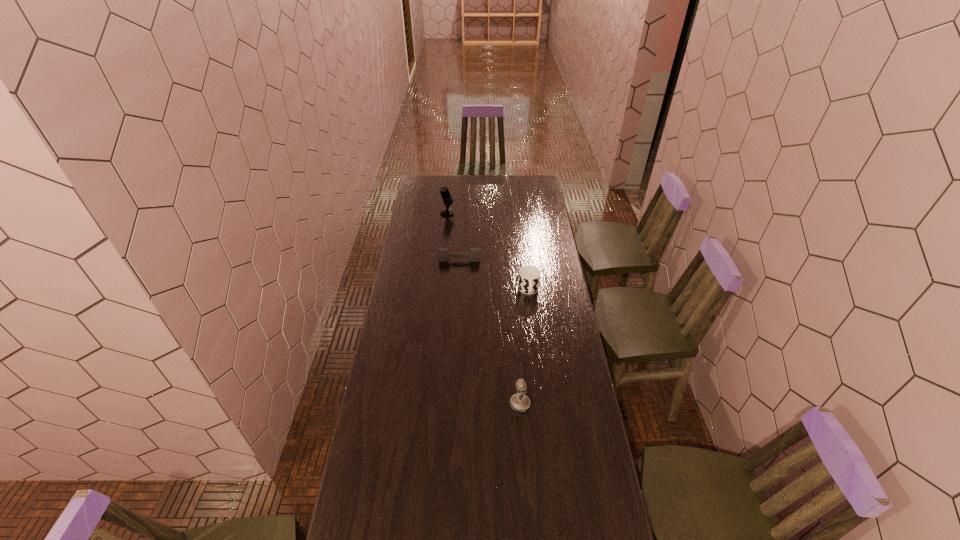
Where is `object that ranks as the closest to the right microphone`? This screenshot has width=960, height=540. object that ranks as the closest to the right microphone is located at coordinates (529, 276).

Image resolution: width=960 pixels, height=540 pixels. In order to click on object that ranks as the closest to the shortest object in this screenshot , I will do (529, 276).

Identify the location of vacant region that satisfies the following two spatial constraints: 1. on the stand of the farther microphone; 2. on the left side of the second farthest object. The height and width of the screenshot is (540, 960). (443, 260).

This screenshot has height=540, width=960. Find the location of `vacant area that satisfies the following two spatial constraints: 1. on the stand of the farther microphone; 2. on the left side of the dumbbell`. vacant area that satisfies the following two spatial constraints: 1. on the stand of the farther microphone; 2. on the left side of the dumbbell is located at coordinates (443, 260).

Image resolution: width=960 pixels, height=540 pixels. I want to click on free location that satisfies the following two spatial constraints: 1. on the side of the second shortest object with the handle; 2. on the front-facing side of the right microphone, so click(x=542, y=404).

Where is `vacant area that satisfies the following two spatial constraints: 1. on the side of the third farthest object with the handle; 2. on the front-facing side of the nearer microphone`? vacant area that satisfies the following two spatial constraints: 1. on the side of the third farthest object with the handle; 2. on the front-facing side of the nearer microphone is located at coordinates (542, 404).